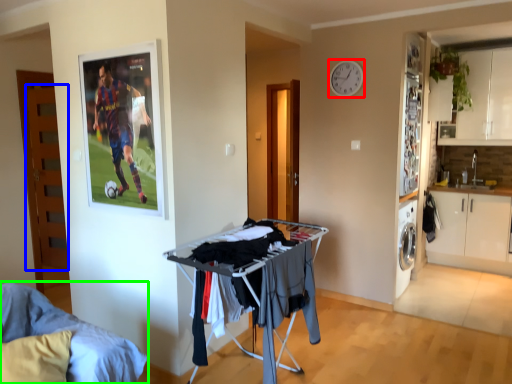
Question: Which object is positioned farthest from clock (highlighted by a red box)? Select from door (highlighted by a blue box) and furniture (highlighted by a green box).

Choices:
 (A) door
 (B) furniture

Answer: (B)